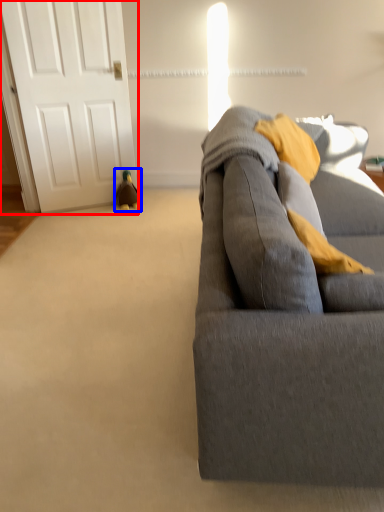
Question: Among these objects, which one is nearest to the camera, door (highlighted by a red box) or toy (highlighted by a blue box)?

Choices:
 (A) door
 (B) toy

Answer: (A)